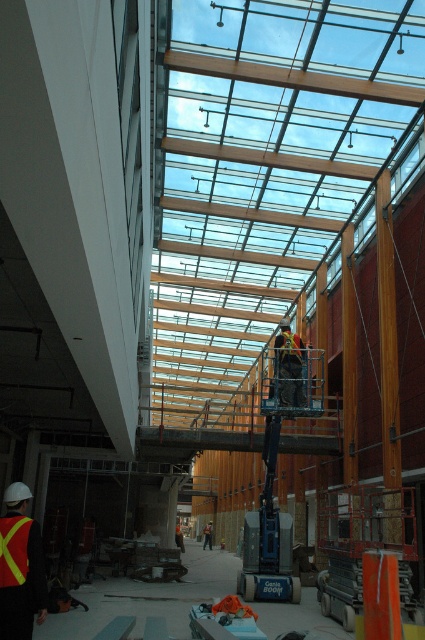
Question: Which point is closer to the camera?

Choices:
 (A) reflective safety vest at center
 (B) orange reflective safety vest at center
 (C) yellow reflective fabric safety vest at lower left
 (D) reflective safety vest at lower left

Answer: (D)

Question: Where is reflective safety vest at lower left located in relation to yellow reflective fabric safety vest at lower left in the image?

Choices:
 (A) below
 (B) above

Answer: (A)

Question: Is reflective safety vest at lower left smaller than reflective safety vest at center?

Choices:
 (A) yes
 (B) no

Answer: (B)

Question: Does yellow reflective fabric safety vest at lower left appear on the right side of orange reflective safety vest at center?

Choices:
 (A) yes
 (B) no

Answer: (B)

Question: Among these points, which one is farthest from the camera?

Choices:
 (A) (14, 586)
 (B) (286, 344)

Answer: (B)

Question: Considering the real-world distances, which object is farthest from the reflective safety vest at lower left?

Choices:
 (A) yellow reflective fabric safety vest at lower left
 (B) reflective safety vest at center
 (C) orange reflective safety vest at center

Answer: (C)